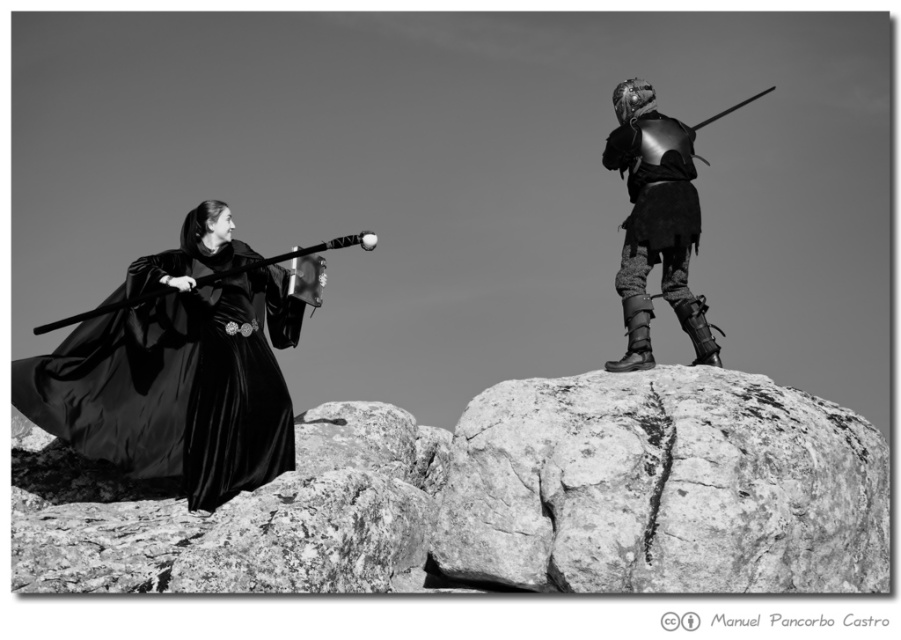
Which is more to the left, rough textured rock at center or velvet black robe at left?

velvet black robe at left is more to the left.

Describe the element at coordinates (663, 486) in the screenshot. I see `rough textured rock at center` at that location.

You are a GUI agent. You are given a task and a screenshot of the screen. Output one action in this format:
    pyautogui.click(x=<x>, y=<y>)
    Task: Click on the rough textured rock at center
    The height and width of the screenshot is (640, 901).
    Given the screenshot: What is the action you would take?
    pyautogui.click(x=663, y=486)